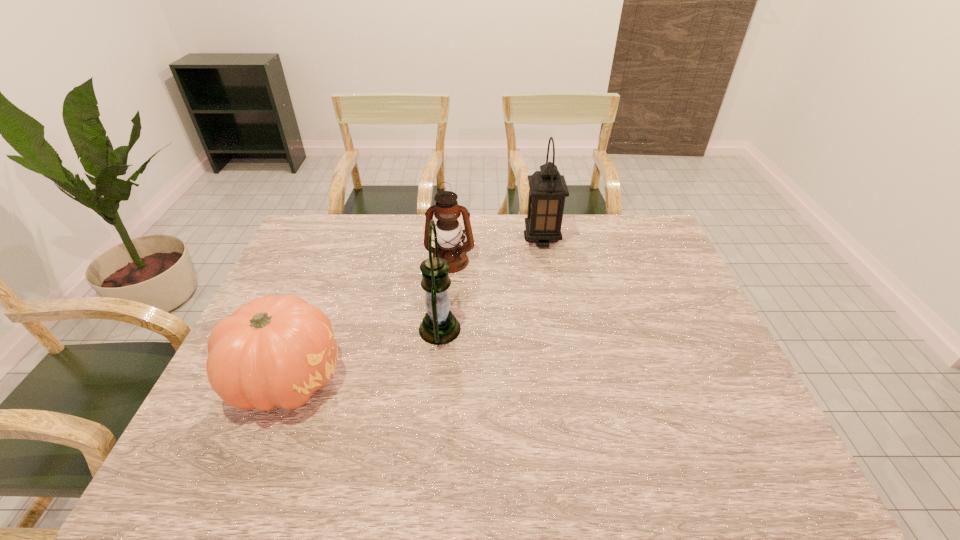
The image size is (960, 540). What are the coordinates of `free space at the far edge of the desktop` in the screenshot? It's located at (345, 247).

The width and height of the screenshot is (960, 540). What are the coordinates of `free space at the left edge of the desktop` in the screenshot? It's located at (293, 293).

This screenshot has width=960, height=540. Find the location of `vacant space at the right edge of the desktop`. vacant space at the right edge of the desktop is located at coordinates (658, 272).

Where is `vacant space at the far left corner of the desktop`? The height and width of the screenshot is (540, 960). vacant space at the far left corner of the desktop is located at coordinates (307, 254).

Where is `free space at the far right corner`? The height and width of the screenshot is (540, 960). free space at the far right corner is located at coordinates (628, 230).

Identify the location of free space at the near right corner of the desktop. (716, 473).

Where is `vacant space that's between the pumpkin and the shortest lantern`? This screenshot has height=540, width=960. vacant space that's between the pumpkin and the shortest lantern is located at coordinates (369, 320).

At what (x,y) coordinates should I click in order to perform the action: click on blank region between the nearest lantern and the rightmost object. Please return your answer as a coordinate pair (x, y). The image size is (960, 540). Looking at the image, I should click on (491, 284).

Identify the location of vacant point located between the nearest lantern and the rightmost object. This screenshot has width=960, height=540. (491, 284).

Image resolution: width=960 pixels, height=540 pixels. What are the coordinates of `free space between the rightmost lantern and the third tallest object` in the screenshot? It's located at (496, 250).